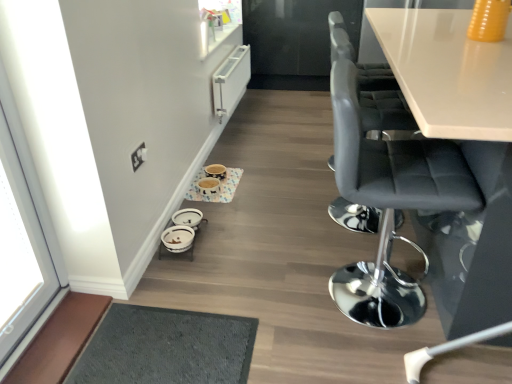
Locate an element on the screen. Image resolution: width=512 pixels, height=384 pixels. free space that is in between black leather stool at right, placed as the first chair when sorted from front to back, and white ceramic bowls at lower center, acting as the first round table starting from the front is located at coordinates (263, 259).